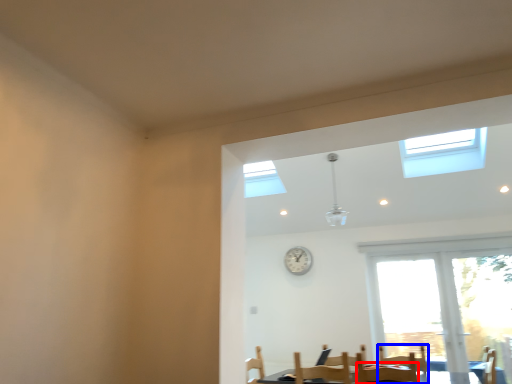
Question: Which point is closer to the camera, chair (highlighted by a red box) or armchair (highlighted by a blue box)?

Choices:
 (A) chair
 (B) armchair

Answer: (A)